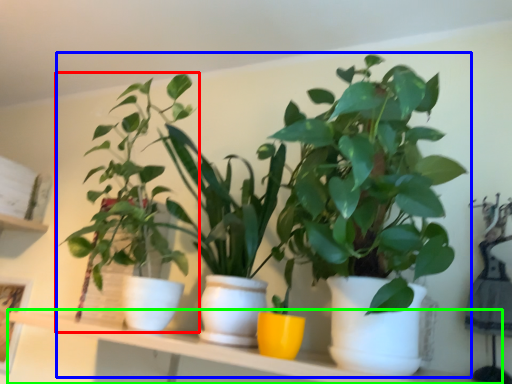
Question: Based on their relative distances, which object is nearer to houseplant (highlighted by a red box)? Choose from houseplant (highlighted by a blue box) and window sill (highlighted by a green box).

Choices:
 (A) houseplant
 (B) window sill

Answer: (A)